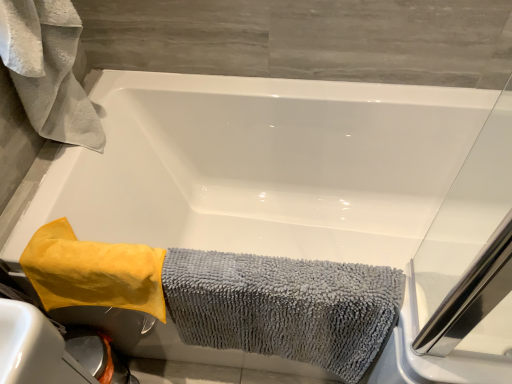
Question: Is white fluffy towel at upper left, which appears as the 1th bath towel when viewed from the left, next to gray microfiber towel at lower left, which is the third bath towel from left to right?

Choices:
 (A) no
 (B) yes

Answer: (A)

Question: Can you confirm if white fluffy towel at upper left, which is the 3th bath towel in right-to-left order, is wider than gray microfiber towel at lower left, positioned as the 1th bath towel in right-to-left order?

Choices:
 (A) no
 (B) yes

Answer: (B)

Question: From the image's perspective, is white fluffy towel at upper left, which appears as the 1th bath towel when viewed from the left, over gray microfiber towel at lower left, positioned as the 1th bath towel in right-to-left order?

Choices:
 (A) yes
 (B) no

Answer: (A)

Question: Does white fluffy towel at upper left, which appears as the 1th bath towel when viewed from the left, have a lesser height compared to gray microfiber towel at lower left, which is the third bath towel from left to right?

Choices:
 (A) yes
 (B) no

Answer: (B)

Question: Considering the relative sizes of white fluffy towel at upper left, which appears as the 1th bath towel when viewed from the left, and gray microfiber towel at lower left, which is the third bath towel from left to right, in the image provided, is white fluffy towel at upper left, which appears as the 1th bath towel when viewed from the left, bigger than gray microfiber towel at lower left, which is the third bath towel from left to right,?

Choices:
 (A) yes
 (B) no

Answer: (B)

Question: In the image, is yellow microfiber towel at lower left, the second bath towel viewed from the left, on the left side or the right side of white fluffy towel at upper left, which is the 3th bath towel in right-to-left order?

Choices:
 (A) right
 (B) left

Answer: (A)

Question: Relative to white fluffy towel at upper left, which appears as the 1th bath towel when viewed from the left, is yellow microfiber towel at lower left, which ranks as the second bath towel in right-to-left order, in front or behind?

Choices:
 (A) front
 (B) behind

Answer: (B)

Question: From the image's perspective, is yellow microfiber towel at lower left, which ranks as the second bath towel in right-to-left order, above or below white fluffy towel at upper left, which appears as the 1th bath towel when viewed from the left?

Choices:
 (A) below
 (B) above

Answer: (A)

Question: From a real-world perspective, is yellow microfiber towel at lower left, the second bath towel viewed from the left, physically located above or below white fluffy towel at upper left, which is the 3th bath towel in right-to-left order?

Choices:
 (A) below
 (B) above

Answer: (A)

Question: Is gray microfiber towel at lower left, which is the third bath towel from left to right, spatially inside yellow microfiber towel at lower left, the second bath towel viewed from the left, or outside of it?

Choices:
 (A) outside
 (B) inside

Answer: (A)

Question: From a real-world perspective, is gray microfiber towel at lower left, positioned as the 1th bath towel in right-to-left order, above or below yellow microfiber towel at lower left, the second bath towel viewed from the left?

Choices:
 (A) above
 (B) below

Answer: (B)

Question: From the image's perspective, is gray microfiber towel at lower left, which is the third bath towel from left to right, located above or below yellow microfiber towel at lower left, the second bath towel viewed from the left?

Choices:
 (A) above
 (B) below

Answer: (B)

Question: Considering the relative positions of gray microfiber towel at lower left, positioned as the 1th bath towel in right-to-left order, and yellow microfiber towel at lower left, which ranks as the second bath towel in right-to-left order, in the image provided, is gray microfiber towel at lower left, positioned as the 1th bath towel in right-to-left order, to the left or to the right of yellow microfiber towel at lower left, which ranks as the second bath towel in right-to-left order,?

Choices:
 (A) left
 (B) right

Answer: (B)

Question: Considering their positions, is white fluffy towel at upper left, which is the 3th bath towel in right-to-left order, located in front of or behind yellow microfiber towel at lower left, which ranks as the second bath towel in right-to-left order?

Choices:
 (A) front
 (B) behind

Answer: (A)

Question: From a real-world perspective, is white fluffy towel at upper left, which appears as the 1th bath towel when viewed from the left, above or below yellow microfiber towel at lower left, which ranks as the second bath towel in right-to-left order?

Choices:
 (A) below
 (B) above

Answer: (B)